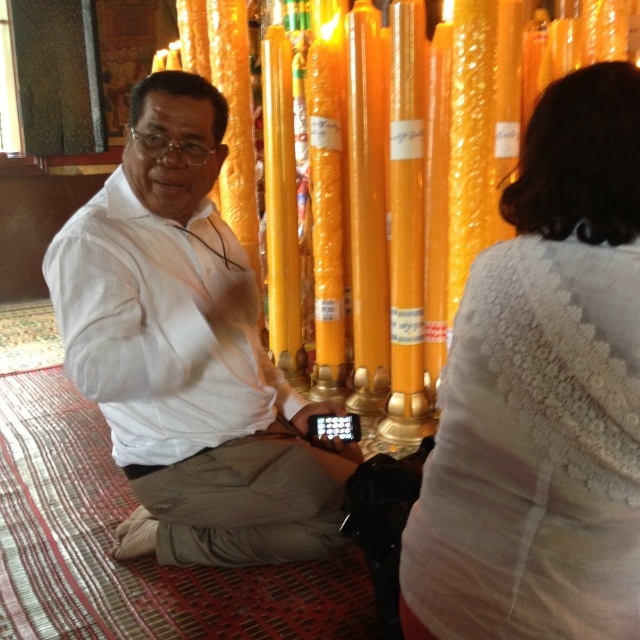
Question: Is white lace sweater at upper right smaller than white matte shirt at center?

Choices:
 (A) yes
 (B) no

Answer: (A)

Question: Which point is closer to the camera?

Choices:
 (A) (513, 250)
 (B) (294, 529)

Answer: (A)

Question: Which object appears farthest from the camera in this image?

Choices:
 (A) white matte shirt at center
 (B) white lace sweater at upper right

Answer: (A)

Question: Can you confirm if white lace sweater at upper right is positioned above white matte shirt at center?

Choices:
 (A) yes
 (B) no

Answer: (B)

Question: Is white lace sweater at upper right thinner than white matte shirt at center?

Choices:
 (A) no
 (B) yes

Answer: (B)